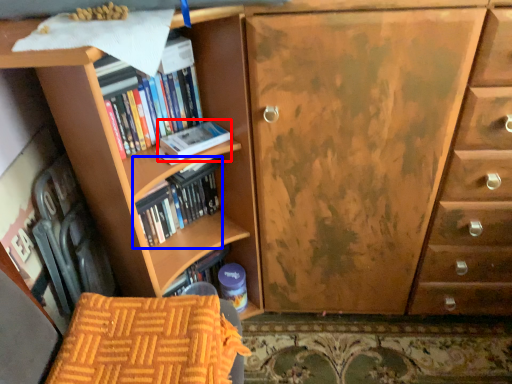
Question: Which object is closer to the camera taking this photo, paperback book (highlighted by a red box) or book (highlighted by a blue box)?

Choices:
 (A) paperback book
 (B) book

Answer: (A)